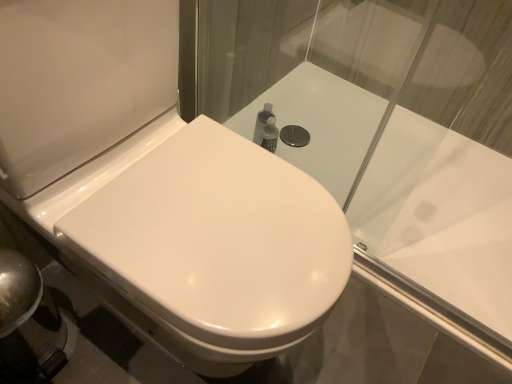
Describe the element at coordinates (440, 215) in the screenshot. I see `white glossy bath at center` at that location.

Image resolution: width=512 pixels, height=384 pixels. I want to click on white glossy bath at center, so click(440, 215).

This screenshot has width=512, height=384. Identify the location of white glossy bath at center. (x=440, y=215).